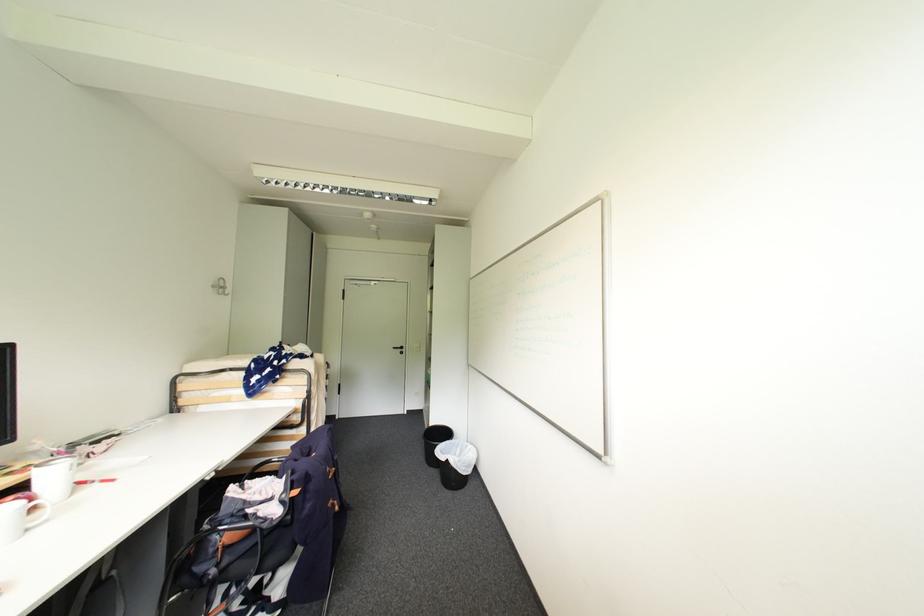
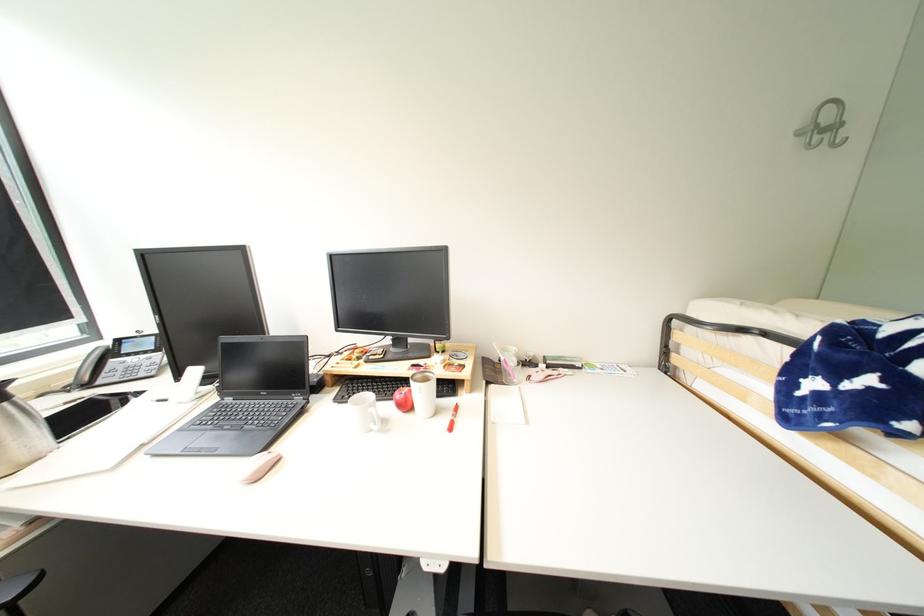
Find the pixel in the second image that matches point 229,288 in the first image.

(841, 128)